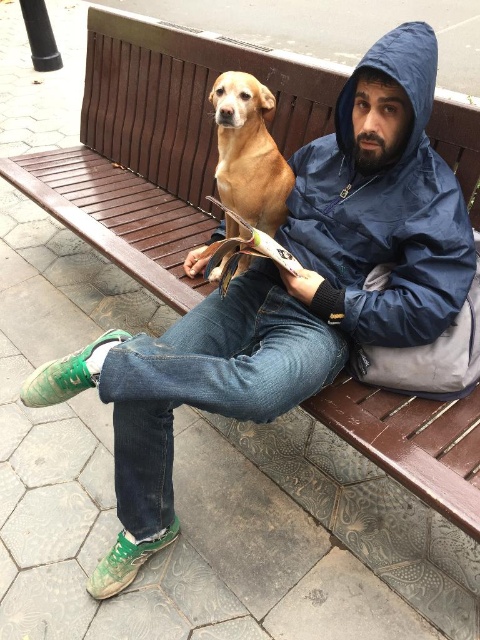
Question: Does blue waterproof jacket at upper right have a larger size compared to golden brown fur at center?

Choices:
 (A) yes
 (B) no

Answer: (A)

Question: Is blue waterproof jacket at upper right bigger than golden brown fur at center?

Choices:
 (A) yes
 (B) no

Answer: (A)

Question: Is blue waterproof jacket at upper right in front of golden brown fur at center?

Choices:
 (A) no
 (B) yes

Answer: (B)

Question: Which point appears closest to the camera in this image?

Choices:
 (A) (229, 141)
 (B) (409, 230)

Answer: (B)